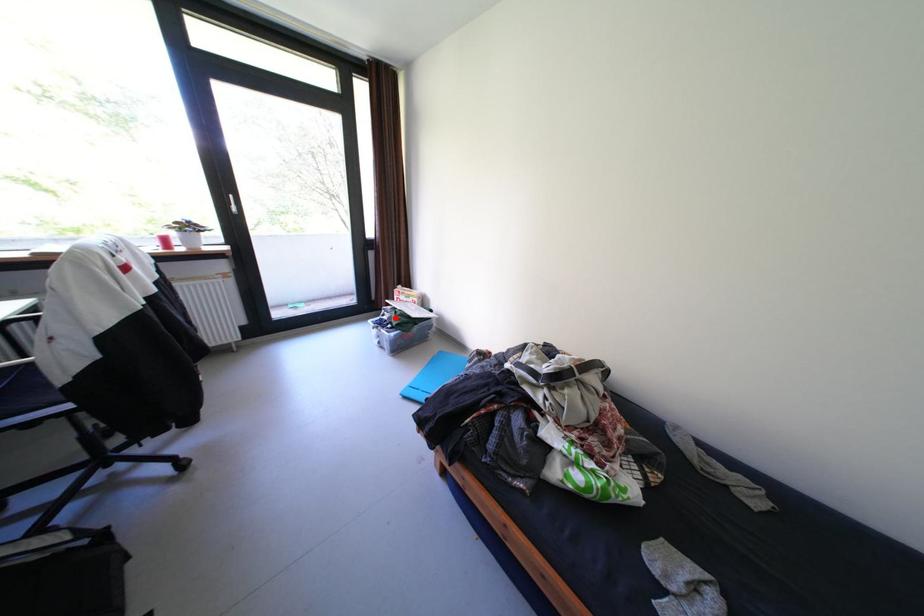
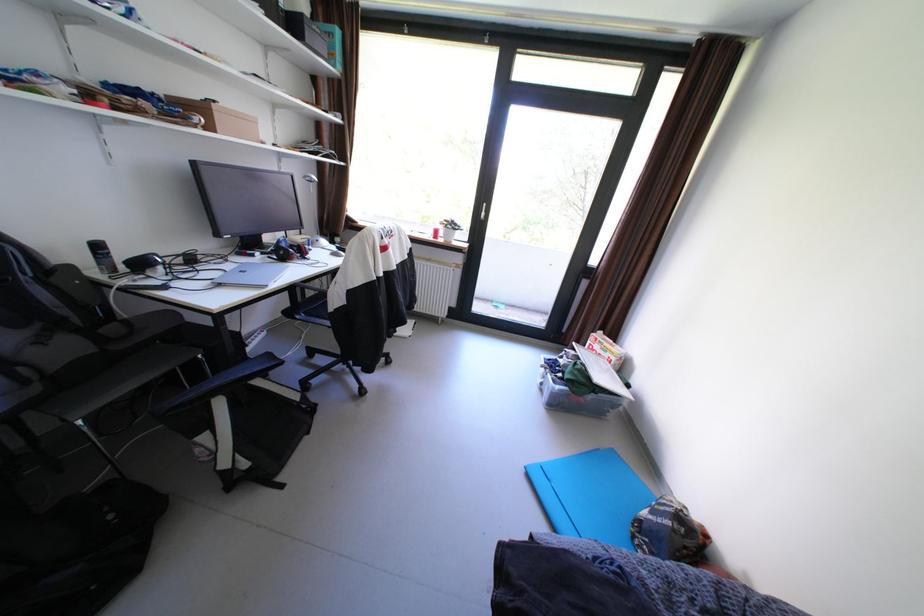
The point at the highlighted location is marked in the first image. Where is the corresponding point in the second image?

(572, 361)